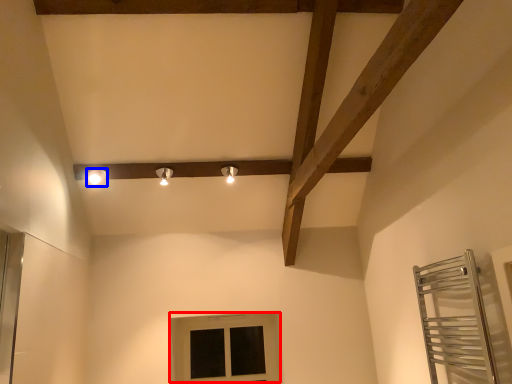
Question: Among these objects, which one is nearest to the camera, window (highlighted by a red box) or light fixture (highlighted by a blue box)?

Choices:
 (A) window
 (B) light fixture

Answer: (B)